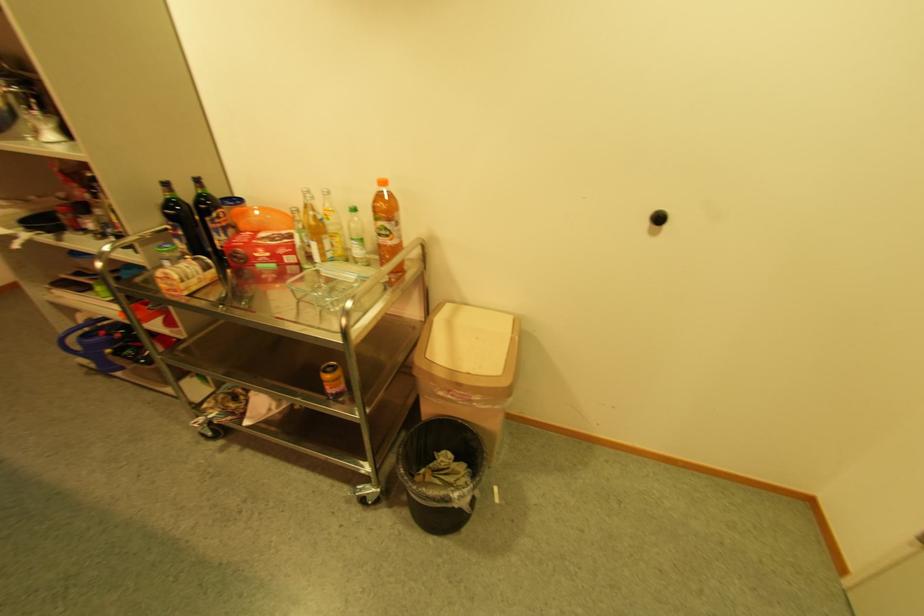
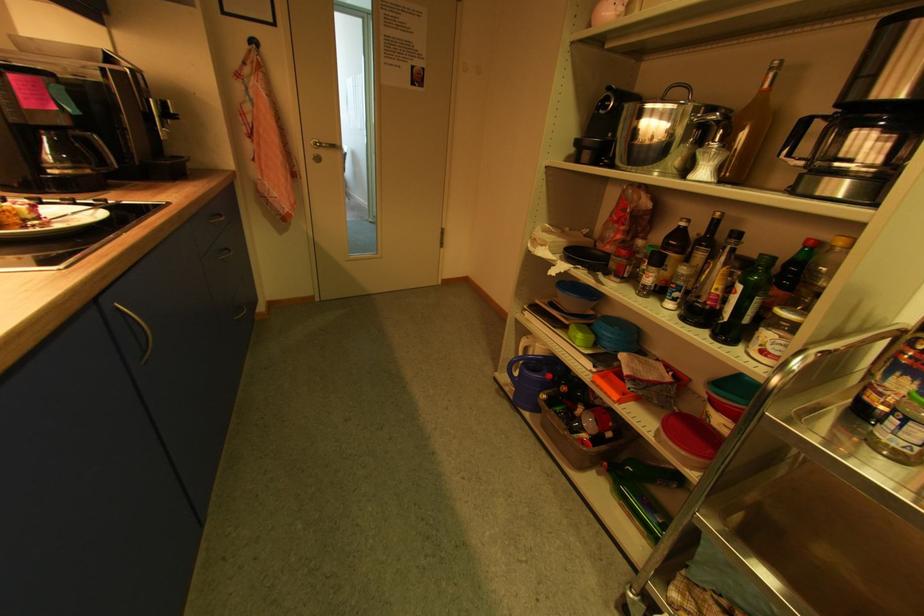
The point at (57, 137) is marked in the first image. Where is the corresponding point in the second image?

(709, 175)